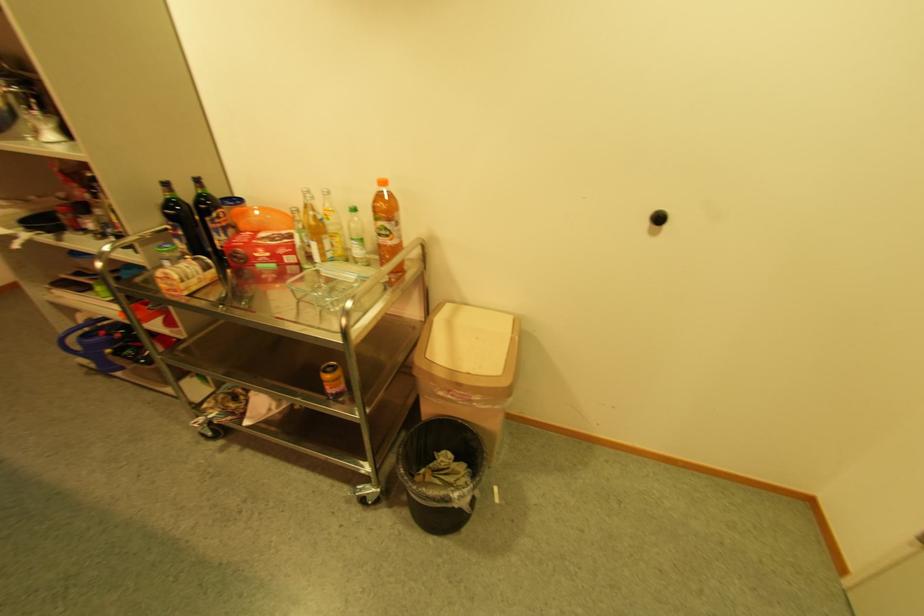
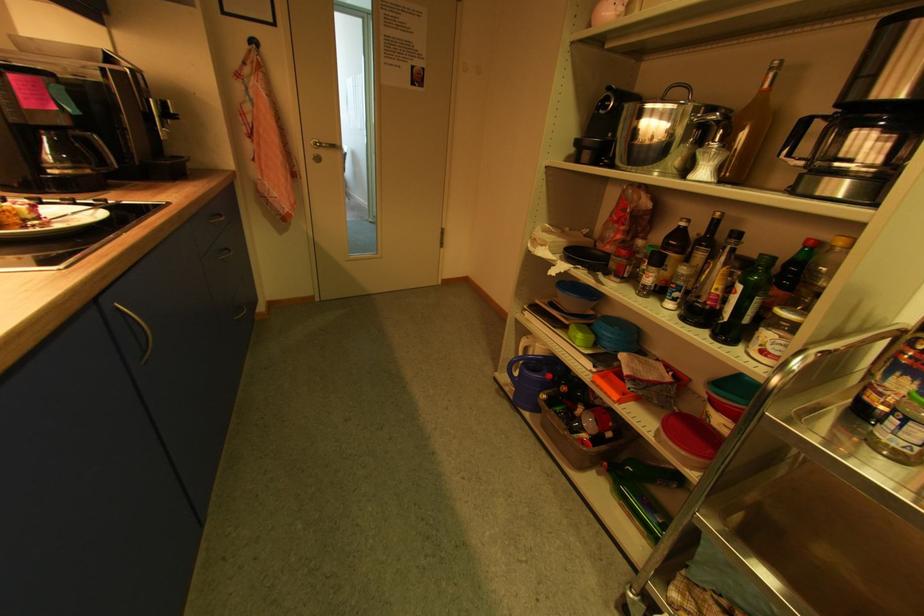
The point at (57, 137) is marked in the first image. Where is the corresponding point in the second image?

(709, 175)